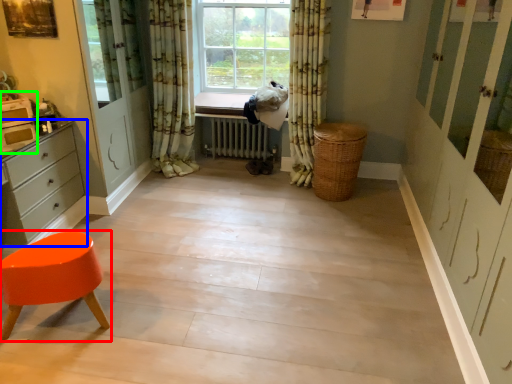
Question: Which is nearer to the stool (highlighted by a red box)? chest of drawers (highlighted by a blue box) or appliance (highlighted by a green box).

Choices:
 (A) chest of drawers
 (B) appliance

Answer: (A)